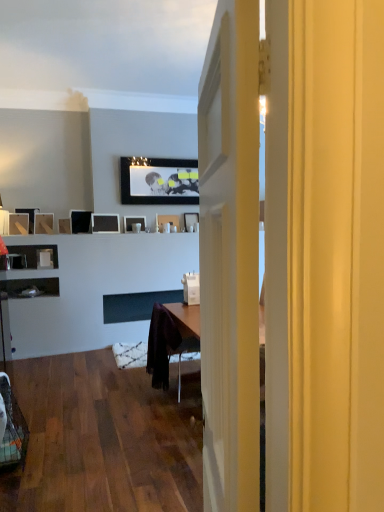
Locate an element on the screen. This screenshot has width=384, height=512. vacant area that lies to the right of plastic mesh swivel chair at lower left is located at coordinates (61, 468).